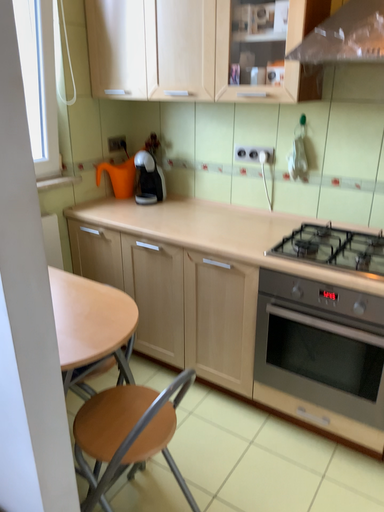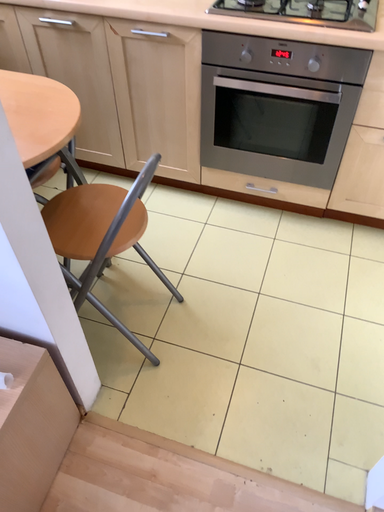
Question: How did the camera likely rotate when shooting the video?

Choices:
 (A) rotated downward
 (B) rotated upward

Answer: (A)